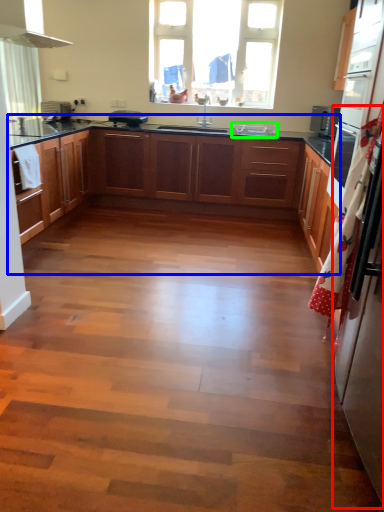
Question: Which is farther away from fridge (highlighted by a red box)? cabinetry (highlighted by a blue box) or sink (highlighted by a green box)?

Choices:
 (A) cabinetry
 (B) sink

Answer: (B)